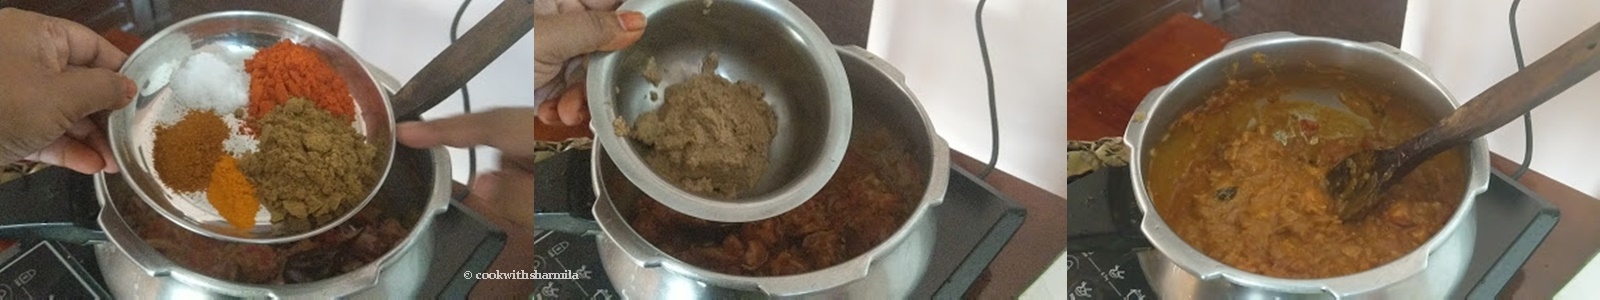
This screenshot has width=1600, height=300. Identify the location of silver pot. (896, 269).